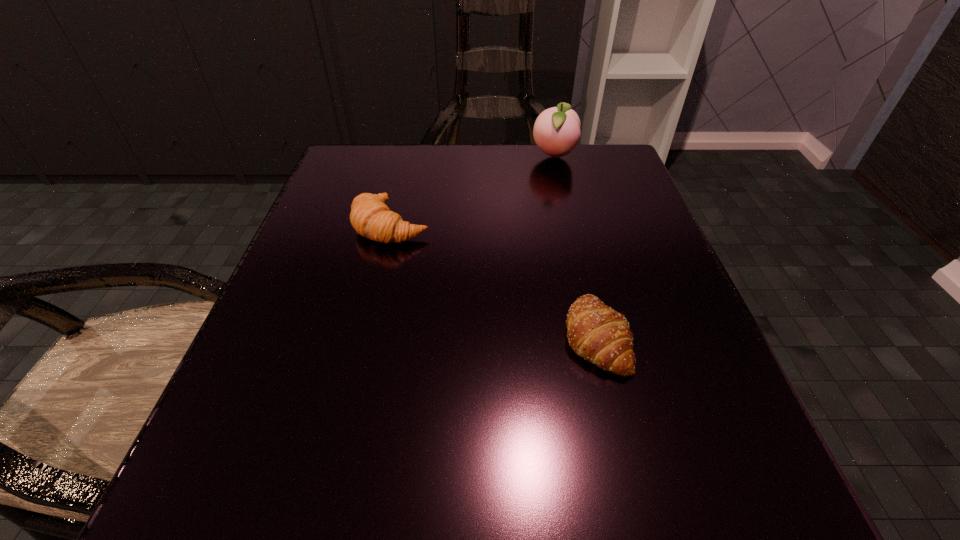
Where is `the farthest object`? The height and width of the screenshot is (540, 960). the farthest object is located at coordinates (556, 131).

I want to click on the tallest object, so click(x=556, y=131).

At what (x,y) coordinates should I click in order to perform the action: click on the second farthest object. Please return your answer as a coordinate pair (x, y). Image resolution: width=960 pixels, height=540 pixels. Looking at the image, I should click on (370, 216).

Locate an element on the screen. the left crescent roll is located at coordinates (370, 216).

Locate an element on the screen. This screenshot has width=960, height=540. the nearest object is located at coordinates (596, 332).

Locate an element on the screen. This screenshot has width=960, height=540. the nearer crescent roll is located at coordinates (596, 332).

Image resolution: width=960 pixels, height=540 pixels. What are the coordinates of `free space located on the front of the farthest object` in the screenshot? It's located at (561, 183).

Identify the location of vacant area situated 0.370m on the right of the second nearest object. (628, 225).

Identify the location of free space located 0.230m on the back of the nearest object. Image resolution: width=960 pixels, height=540 pixels. (566, 213).

Where is `object that is positioned at the far edge`? object that is positioned at the far edge is located at coordinates (556, 131).